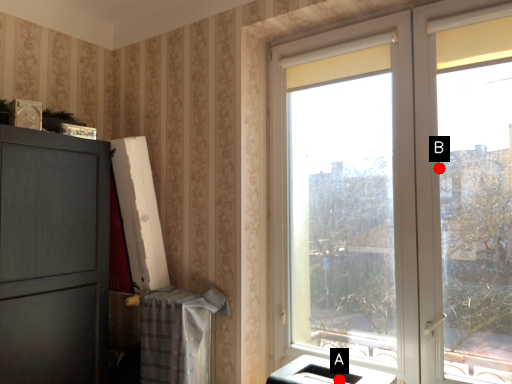
Question: Two points are circled on the image, labeled by A and B beside each circle. Which point is farther to the camera?

Choices:
 (A) A is further
 (B) B is further

Answer: (A)